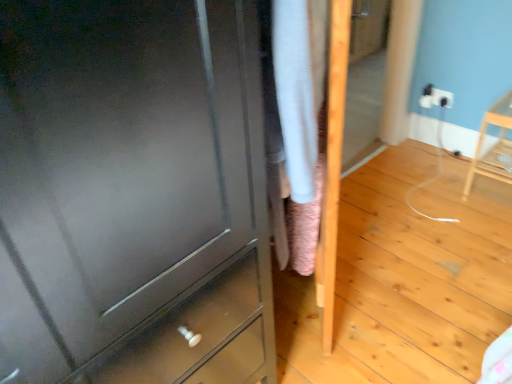
Measure the distance between light wood chair at right and camera.

1.97 meters.

This screenshot has width=512, height=384. I want to click on matte gray chest of drawers at center, so click(133, 194).

The width and height of the screenshot is (512, 384). What are the coordinates of `light wood chair at right` in the screenshot? It's located at (x=494, y=146).

Can you confirm if matte gray chest of drawers at center is positioned to the right of light wood chair at right?

No, matte gray chest of drawers at center is not to the right of light wood chair at right.

Does matte gray chest of drawers at center touch light wood chair at right?

No, matte gray chest of drawers at center is not touching light wood chair at right.

In terms of height, does matte gray chest of drawers at center look taller or shorter compared to light wood chair at right?

Clearly, matte gray chest of drawers at center is taller compared to light wood chair at right.

Would you say white plastic electric outlet at upper right contains matte gray chest of drawers at center?

Actually, matte gray chest of drawers at center is outside white plastic electric outlet at upper right.

Could you tell me if white plastic electric outlet at upper right is turned towards matte gray chest of drawers at center?

Yes, white plastic electric outlet at upper right is facing matte gray chest of drawers at center.

Is point (426, 98) behind point (109, 164)?

Yes, point (426, 98) is behind point (109, 164).

From a real-world perspective, is white plastic electric outlet at upper right under light wood chair at right?

No, from a real-world perspective, white plastic electric outlet at upper right is not beneath light wood chair at right.

Who is bigger, white plastic electric outlet at upper right or light wood chair at right?

Bigger between the two is light wood chair at right.

Is point (426, 107) less distant than point (495, 179)?

No.

Does white plastic electric outlet at upper right lie in front of light wood chair at right?

No, the depth of white plastic electric outlet at upper right is greater than that of light wood chair at right.

Is matte gray chest of drawers at center aimed at white plastic electric outlet at upper right?

No, matte gray chest of drawers at center is not oriented towards white plastic electric outlet at upper right.

Is the position of matte gray chest of drawers at center more distant than that of white plastic electric outlet at upper right?

No, matte gray chest of drawers at center is in front of white plastic electric outlet at upper right.

Is point (245, 350) closer or farther from the camera than point (426, 98)?

Point (245, 350) appears to be closer to the viewer than point (426, 98).

Considering the sizes of objects matte gray chest of drawers at center and white plastic electric outlet at upper right in the image provided, who is bigger, matte gray chest of drawers at center or white plastic electric outlet at upper right?

With larger size is matte gray chest of drawers at center.

Considering the sizes of objects light wood chair at right and white plastic electric outlet at upper right in the image provided, who is smaller, light wood chair at right or white plastic electric outlet at upper right?

white plastic electric outlet at upper right is smaller.

Does point (489, 122) come farther from viewer compared to point (420, 100)?

No, it is not.

Is the depth of light wood chair at right greater than that of white plastic electric outlet at upper right?

No, it is in front of white plastic electric outlet at upper right.

Is light wood chair at right not within white plastic electric outlet at upper right?

Yes, light wood chair at right is not within white plastic electric outlet at upper right.

Considering their positions, is light wood chair at right located in front of or behind matte gray chest of drawers at center?

Visually, light wood chair at right is located behind matte gray chest of drawers at center.

From the image's perspective, which one is positioned higher, light wood chair at right or matte gray chest of drawers at center?

From the image's view, light wood chair at right is above.

The height and width of the screenshot is (384, 512). I want to click on furniture behind the matte gray chest of drawers at center, so click(x=494, y=146).

Does point (475, 171) come in front of point (77, 40)?

No, it is behind (77, 40).

Locate an element on the screen. Image resolution: width=512 pixels, height=384 pixels. furniture that is under the matte gray chest of drawers at center (from a real-world perspective) is located at coordinates (494, 146).

Where is `electric outlet above the matte gray chest of drawers at center (from the image's perspective)`? electric outlet above the matte gray chest of drawers at center (from the image's perspective) is located at coordinates (426, 96).

Which object lies further to the anchor point white plastic electric outlet at upper right, light wood chair at right or matte gray chest of drawers at center?

matte gray chest of drawers at center is further to white plastic electric outlet at upper right.

Based on their spatial positions, is light wood chair at right or white plastic electric outlet at upper right further from matte gray chest of drawers at center?

white plastic electric outlet at upper right is further to matte gray chest of drawers at center.

From the image, which object appears to be farther from matte gray chest of drawers at center, white plastic electric outlet at upper right or light wood chair at right?

white plastic electric outlet at upper right lies further to matte gray chest of drawers at center than the other object.

When comparing their distances from light wood chair at right, does white plastic electric outlet at upper right or matte gray chest of drawers at center seem closer?

Among the two, white plastic electric outlet at upper right is located nearer to light wood chair at right.

Estimate the real-world distances between objects in this image. Which object is further from white plastic electric outlet at upper right, matte gray chest of drawers at center or light wood chair at right?

matte gray chest of drawers at center lies further to white plastic electric outlet at upper right than the other object.

From the image, which object appears to be nearer to light wood chair at right, matte gray chest of drawers at center or white plastic electric outlet at upper right?

white plastic electric outlet at upper right.

Where is `furniture between matte gray chest of drawers at center and white plastic electric outlet at upper right along the z-axis`? furniture between matte gray chest of drawers at center and white plastic electric outlet at upper right along the z-axis is located at coordinates (494, 146).